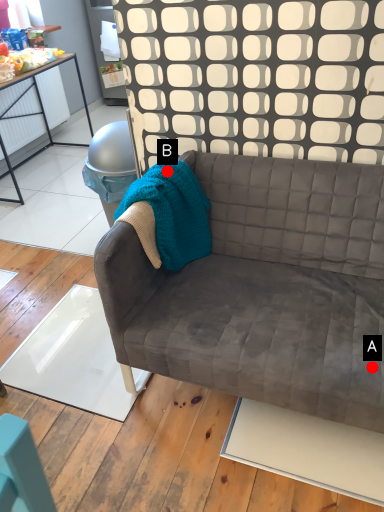
Question: Two points are circled on the image, labeled by A and B beside each circle. Which point appears closest to the camera in this image?

Choices:
 (A) A is closer
 (B) B is closer

Answer: (A)